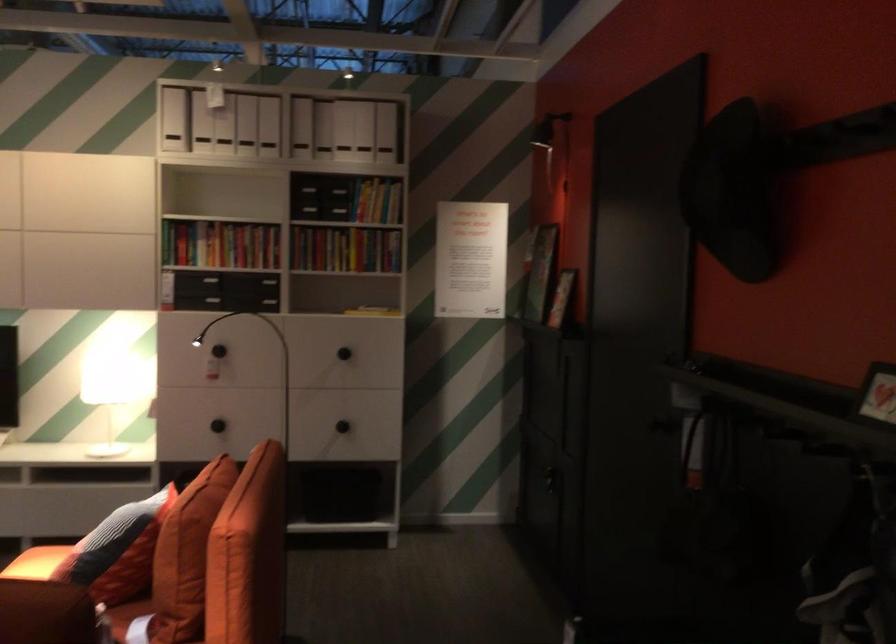
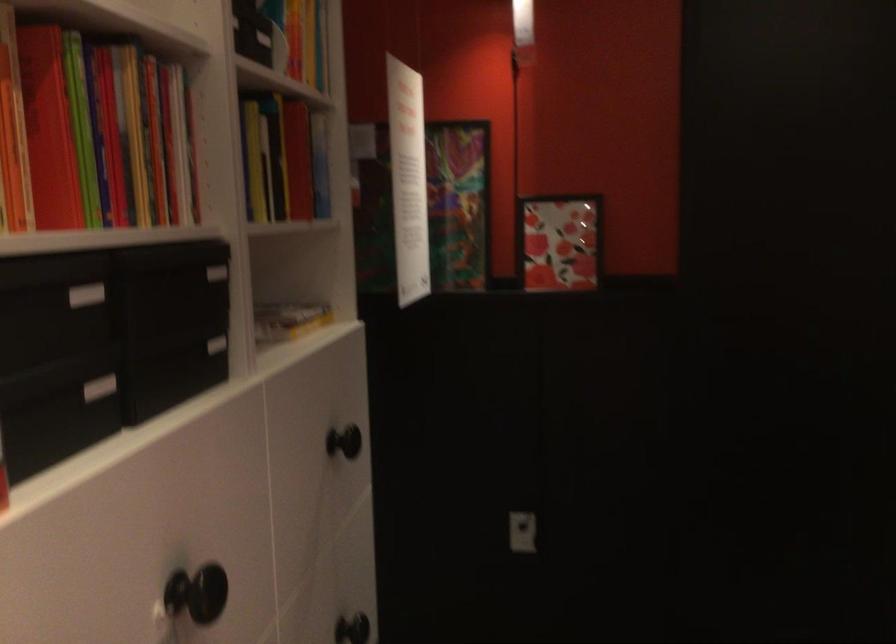
Where in the second image is the point corresponding to pixel 340 238 from the first image?

(282, 158)